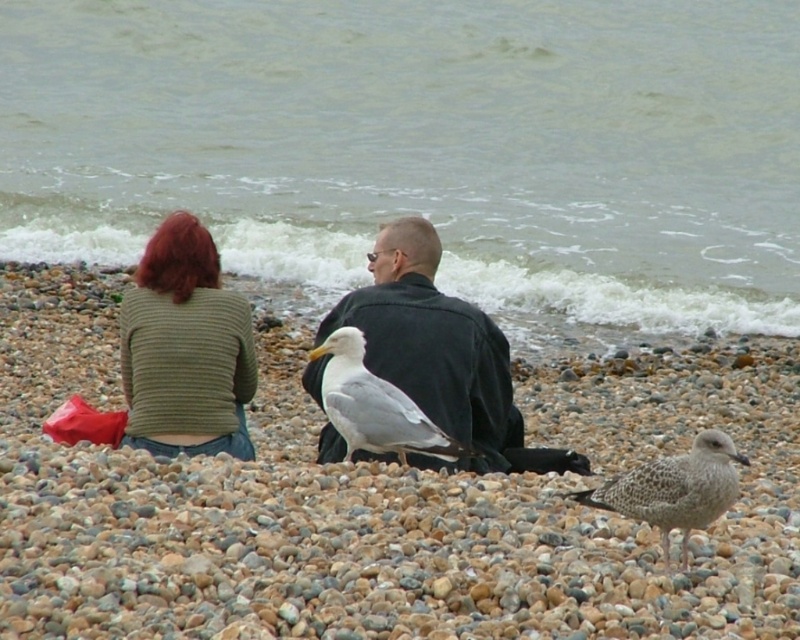
You are a photographer trying to capture a closeup of the green knitted sweater at lower left while also including the smooth pebbles at center in the frame. Based on their positions, will you need to adjust your camera angle to the left or right to include both objects?

The smooth pebbles at center is positioned on the left side of green knitted sweater at lower left, so to include both in the frame, you should adjust your camera angle to the right to capture the green knitted sweater at lower left and the smooth pebbles at center to its left.

You are standing at the edge of the beach looking towards the ocean. You see two points marked in the scene. Which point is closer to you, point (584, 170) or point (138, 401)?

Point (138, 401) is closer to you because it is nearer to the camera compared to point (584, 170) which is further away.